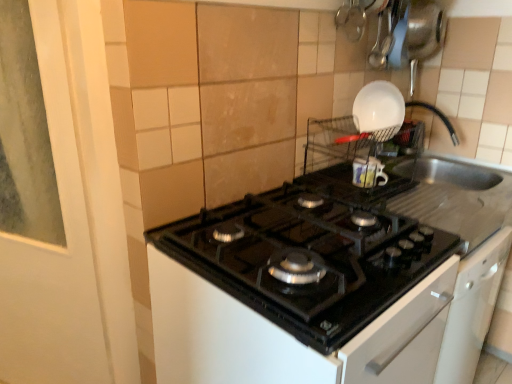
Question: Should I look upward or downward to see white glossy bowl at upper right?

Choices:
 (A) down
 (B) up

Answer: (B)

Question: Should I look upward or downward to see black glass gas stove at center?

Choices:
 (A) up
 (B) down

Answer: (B)

Question: Considering the relative sizes of white glossy bowl at upper right and black glass gas stove at center in the image provided, is white glossy bowl at upper right shorter than black glass gas stove at center?

Choices:
 (A) no
 (B) yes

Answer: (A)

Question: Is white glossy bowl at upper right facing away from black glass gas stove at center?

Choices:
 (A) yes
 (B) no

Answer: (B)

Question: Is white glossy bowl at upper right positioned behind black glass gas stove at center?

Choices:
 (A) yes
 (B) no

Answer: (A)

Question: Can black glass gas stove at center be found inside white glossy bowl at upper right?

Choices:
 (A) yes
 (B) no

Answer: (B)

Question: Does white glossy bowl at upper right lie in front of black glass gas stove at center?

Choices:
 (A) no
 (B) yes

Answer: (A)

Question: Does white glossy bowl at upper right have a greater height compared to black glass gas stove at center?

Choices:
 (A) no
 (B) yes

Answer: (B)

Question: From the image's perspective, is black glass gas stove at center under white glossy bowl at upper right?

Choices:
 (A) yes
 (B) no

Answer: (A)

Question: Considering the relative sizes of black glass gas stove at center and white glossy bowl at upper right in the image provided, is black glass gas stove at center wider than white glossy bowl at upper right?

Choices:
 (A) no
 (B) yes

Answer: (B)

Question: Considering the relative sizes of black glass gas stove at center and white glossy bowl at upper right in the image provided, is black glass gas stove at center taller than white glossy bowl at upper right?

Choices:
 (A) yes
 (B) no

Answer: (B)

Question: From a real-world perspective, is black glass gas stove at center physically above white glossy bowl at upper right?

Choices:
 (A) no
 (B) yes

Answer: (A)

Question: Could you tell me if black glass gas stove at center is turned towards white glossy bowl at upper right?

Choices:
 (A) yes
 (B) no

Answer: (B)

Question: Is black glass gas stove at center bigger than white glossy bowl at upper right?

Choices:
 (A) yes
 (B) no

Answer: (A)

Question: Looking at their shapes, would you say black glass gas stove at center is wider or thinner than white glossy bowl at upper right?

Choices:
 (A) thin
 (B) wide

Answer: (B)